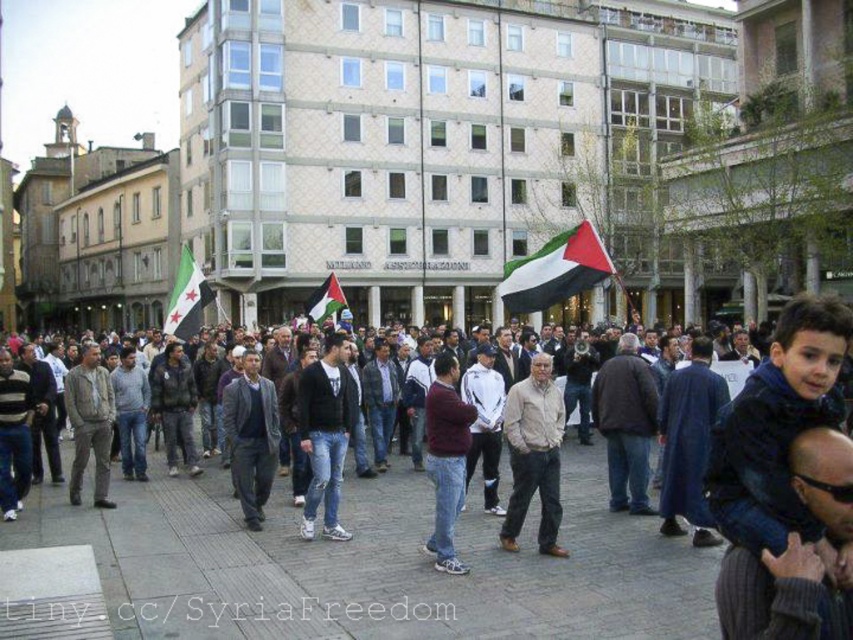
Question: Can you confirm if dark gray wool sweater at center is positioned to the left of striped sweater at center?

Choices:
 (A) yes
 (B) no

Answer: (B)

Question: Which object is farther from the camera taking this photo?

Choices:
 (A) light brown leather jacket at center
 (B) ripped denim jeans at center
 (C) palestinian flag at center
 (D) dark blue jeans at center

Answer: (C)

Question: Is dark blue jeans at center below dark gray jacket at center?

Choices:
 (A) yes
 (B) no

Answer: (A)

Question: Which of these objects is positioned closest to the dark gray wool sweater at center?

Choices:
 (A) striped sweater at center
 (B) dark blue jeans at center
 (C) white matte flag at center
 (D) dark blue sweater at lower right

Answer: (A)

Question: Based on their relative distances, which object is nearer to the striped sweater at center?

Choices:
 (A) dark blue sweater at lower right
 (B) dark blue jeans at center
 (C) white matte flag at center

Answer: (C)

Question: Is dark gray jacket at center below palestinian flag at center?

Choices:
 (A) no
 (B) yes

Answer: (B)